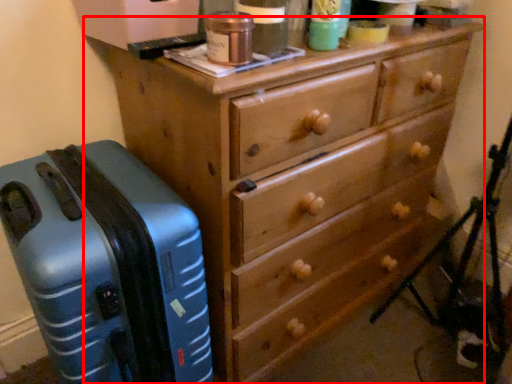
Question: From the image's perspective, considering the relative positions of chest of drawers (annotated by the red box) and suitcase in the image provided, where is chest of drawers (annotated by the red box) located with respect to the staircase?

Choices:
 (A) below
 (B) above

Answer: (B)